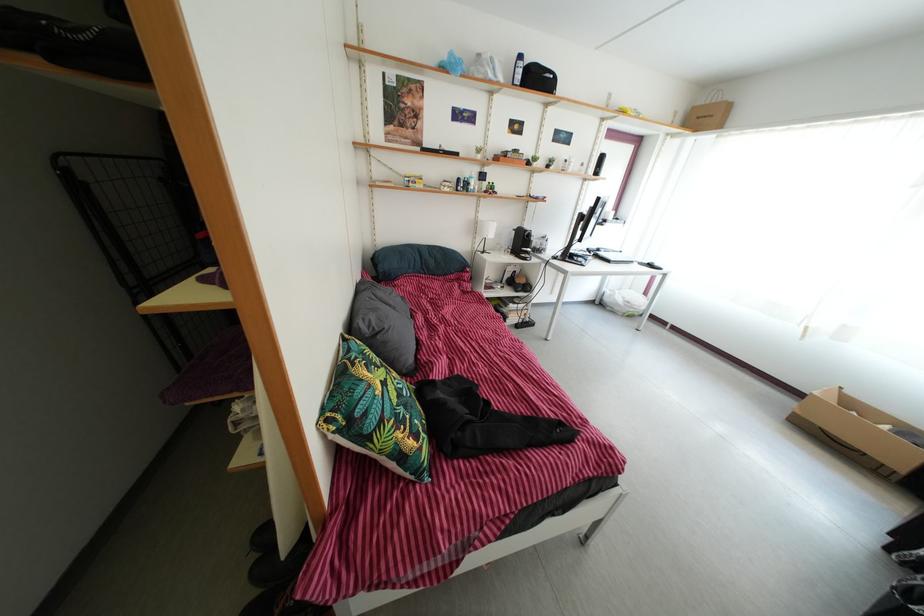
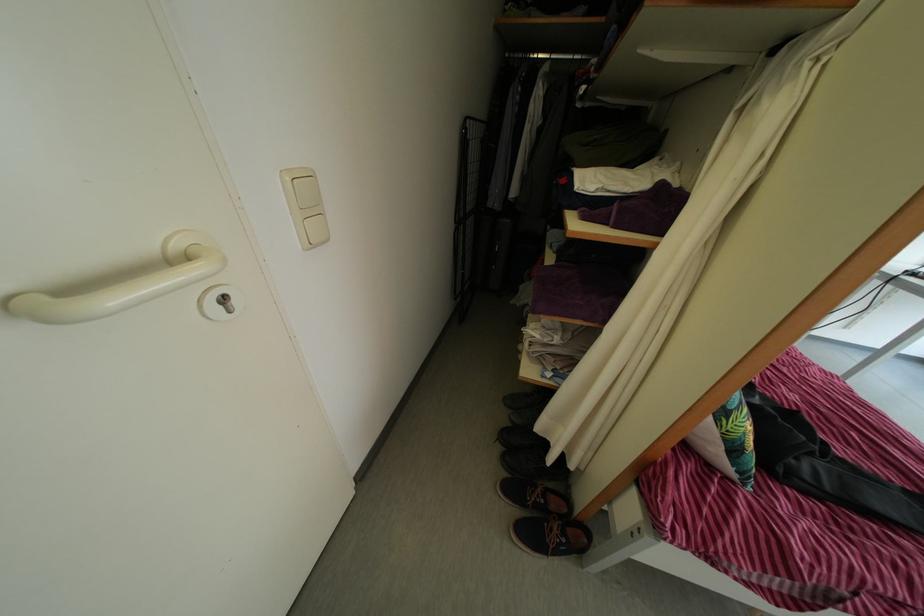
Locate, in the second image, the point that corresponds to the point at 394,464 in the first image.

(732, 448)